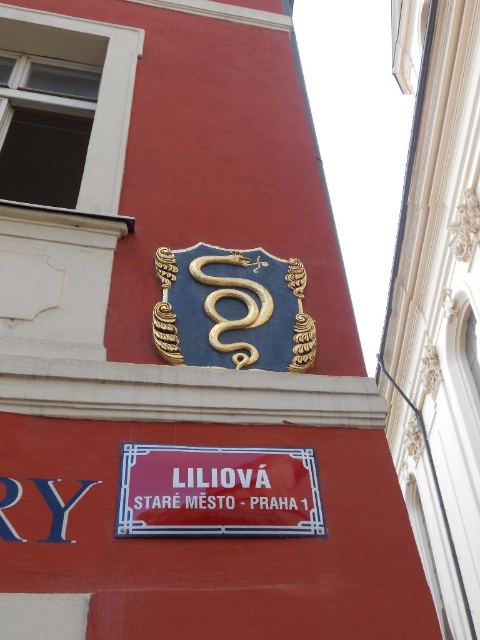
Can you confirm if gold metallic snake at center is thinner than gold textured snake at upper center?

In fact, gold metallic snake at center might be wider than gold textured snake at upper center.

Does gold metallic snake at center have a smaller size compared to gold textured snake at upper center?

Indeed, gold metallic snake at center has a smaller size compared to gold textured snake at upper center.

Is point (317, 490) farther from camera compared to point (216, 291)?

No, (317, 490) is closer to viewer.

At what (x,y) coordinates should I click in order to perform the action: click on gold metallic snake at center. Please return your answer as a coordinate pair (x, y). Looking at the image, I should click on (217, 492).